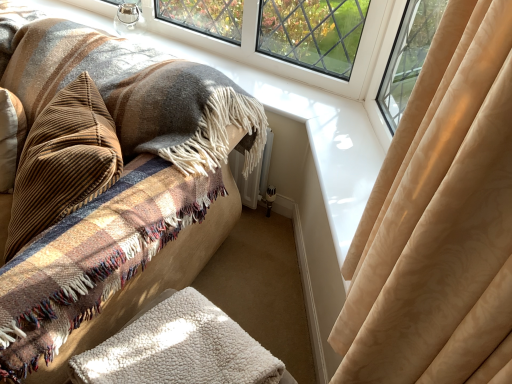
Question: Should I look upward or downward to see white fluffy blanket at lower center?

Choices:
 (A) up
 (B) down

Answer: (B)

Question: Does plush beige rug at lower center contain brown corduroy pillow at left?

Choices:
 (A) yes
 (B) no

Answer: (A)

Question: Is plush beige rug at lower center touching brown corduroy pillow at left?

Choices:
 (A) no
 (B) yes

Answer: (B)

Question: Can you confirm if plush beige rug at lower center is wider than brown corduroy pillow at left?

Choices:
 (A) no
 (B) yes

Answer: (B)

Question: Is plush beige rug at lower center positioned with its back to brown corduroy pillow at left?

Choices:
 (A) yes
 (B) no

Answer: (A)

Question: Can you confirm if plush beige rug at lower center is bigger than brown corduroy pillow at left?

Choices:
 (A) yes
 (B) no

Answer: (A)

Question: From a real-world perspective, is plush beige rug at lower center positioned over brown corduroy pillow at left based on gravity?

Choices:
 (A) no
 (B) yes

Answer: (A)

Question: Can we say white fluffy blanket at lower center lies outside plush beige rug at lower center?

Choices:
 (A) no
 (B) yes

Answer: (B)

Question: Is white fluffy blanket at lower center not close to plush beige rug at lower center?

Choices:
 (A) yes
 (B) no

Answer: (B)

Question: Is white fluffy blanket at lower center bigger than plush beige rug at lower center?

Choices:
 (A) yes
 (B) no

Answer: (B)

Question: From a real-world perspective, is white fluffy blanket at lower center positioned over plush beige rug at lower center based on gravity?

Choices:
 (A) no
 (B) yes

Answer: (B)

Question: Considering the relative sizes of white fluffy blanket at lower center and plush beige rug at lower center in the image provided, is white fluffy blanket at lower center shorter than plush beige rug at lower center?

Choices:
 (A) no
 (B) yes

Answer: (B)

Question: Is white fluffy blanket at lower center to the right of plush beige rug at lower center from the viewer's perspective?

Choices:
 (A) yes
 (B) no

Answer: (A)

Question: Is brown corduroy pillow at left next to plush beige rug at lower center and touching it?

Choices:
 (A) no
 (B) yes

Answer: (B)